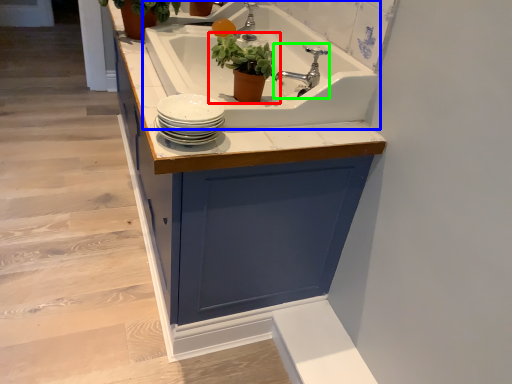
Question: Considering the real-world distances, which object is farthest from houseplant (highlighted by a red box)? sink (highlighted by a blue box) or tap (highlighted by a green box)?

Choices:
 (A) sink
 (B) tap

Answer: (A)